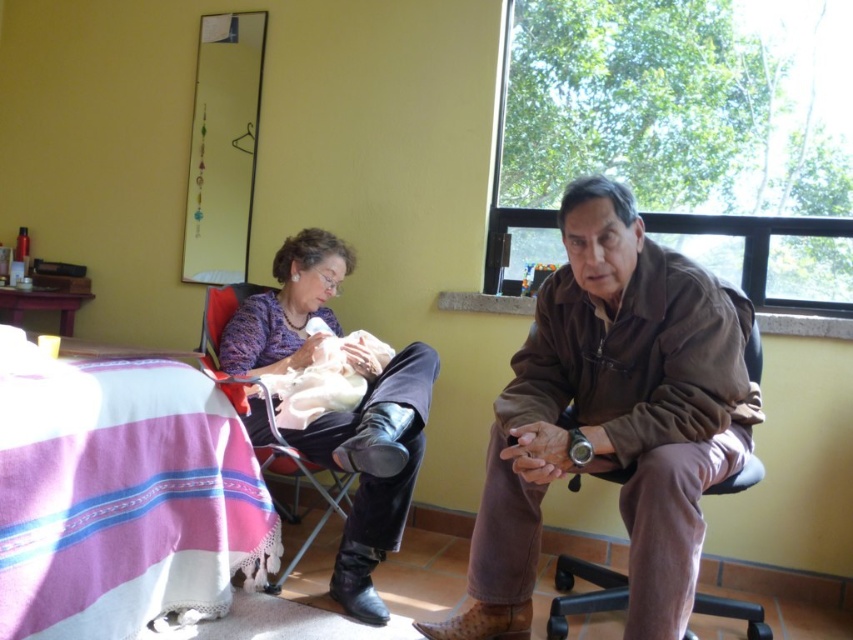
You are standing in the room and want to reach the pink striped fabric at lower left to adjust its position. Considering your height is 1.7 meters, can you comfortably reach it without needing a stool?

The pink striped fabric at lower left is 1.38 meters away from you. Since your height is 1.7 meters, you can comfortably reach it without needing a stool as the distance is within your comfortable reach range.

You are a guest in this room and want to hang your brown suede jacket at center on the back of the brown leather armchair at center. Is the jacket taller than the chair?

The brown suede jacket at center is taller than the brown leather armchair at center, so it will not fit properly on the back of the chair.